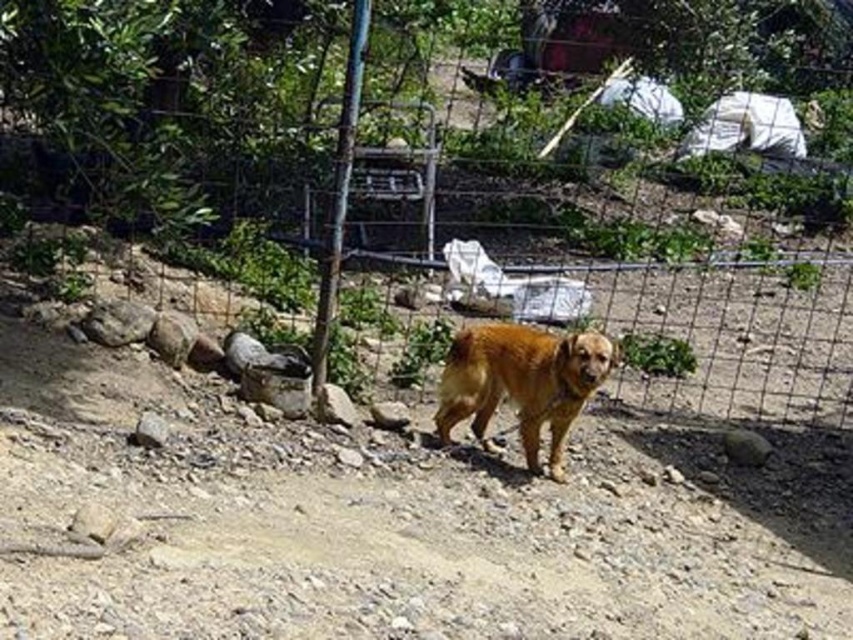
Can you confirm if wire mesh fence at center is positioned above brown dirt field at center?

Indeed, wire mesh fence at center is positioned over brown dirt field at center.

Which of these two, wire mesh fence at center or brown dirt field at center, stands shorter?

With less height is wire mesh fence at center.

Describe the element at coordinates (462, 170) in the screenshot. This screenshot has height=640, width=853. I see `wire mesh fence at center` at that location.

Where is `wire mesh fence at center`? The height and width of the screenshot is (640, 853). wire mesh fence at center is located at coordinates (462, 170).

Can you confirm if brown dirt field at center is positioned to the left of golden fur dog at center?

Correct, you'll find brown dirt field at center to the left of golden fur dog at center.

Does brown dirt field at center come behind golden fur dog at center?

No, brown dirt field at center is in front of golden fur dog at center.

Locate an element on the screen. brown dirt field at center is located at coordinates pyautogui.click(x=395, y=520).

The height and width of the screenshot is (640, 853). Identify the location of brown dirt field at center. (395, 520).

Consider the image. Is wire mesh fence at center to the left of golden fur dog at center from the viewer's perspective?

In fact, wire mesh fence at center is to the right of golden fur dog at center.

Who is lower down, wire mesh fence at center or golden fur dog at center?

Positioned lower is golden fur dog at center.

Where is `wire mesh fence at center`? The width and height of the screenshot is (853, 640). wire mesh fence at center is located at coordinates (462, 170).